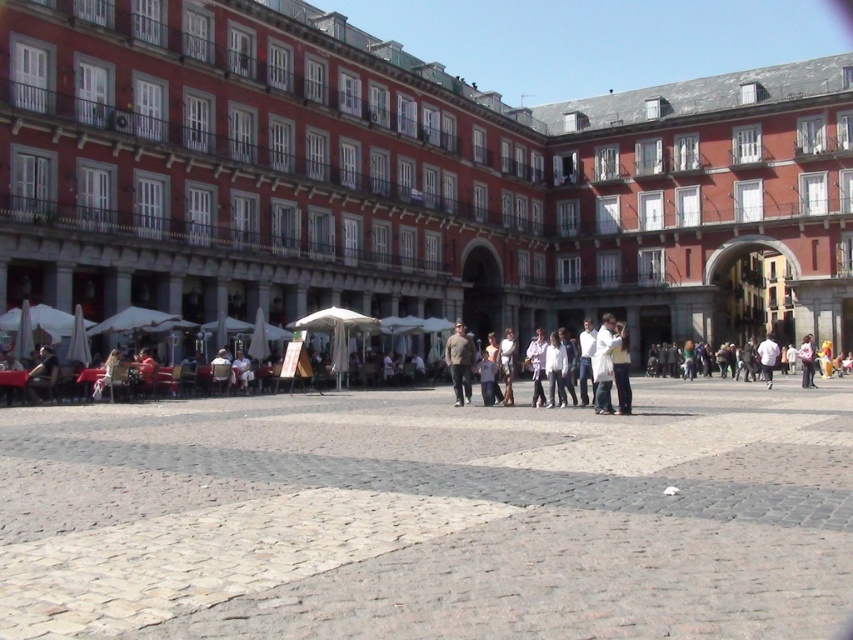
Question: Based on their relative distances, which object is farther from the red brick building at center?

Choices:
 (A) white cotton shirt at center
 (B) brown textured shirt at center

Answer: (B)

Question: Which point is closer to the camera taking this photo?

Choices:
 (A) (68, 332)
 (B) (467, 340)
 (C) (273, 6)

Answer: (A)

Question: Where is red brick building at center located in relation to brown textured shirt at center in the image?

Choices:
 (A) above
 (B) below

Answer: (A)

Question: Does red brick building at center have a lesser width compared to white cotton shirt at center?

Choices:
 (A) no
 (B) yes

Answer: (A)

Question: Can you confirm if red brick building at center is smaller than white cotton shirt at center?

Choices:
 (A) yes
 (B) no

Answer: (B)

Question: Among these points, which one is nearest to the camera?

Choices:
 (A) (387, 355)
 (B) (469, 355)
 (C) (306, 40)

Answer: (B)